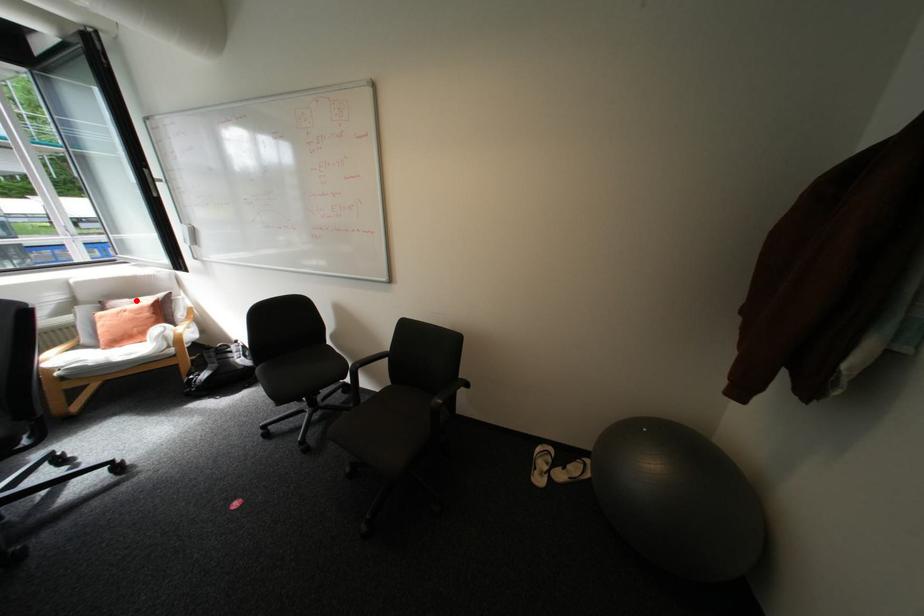
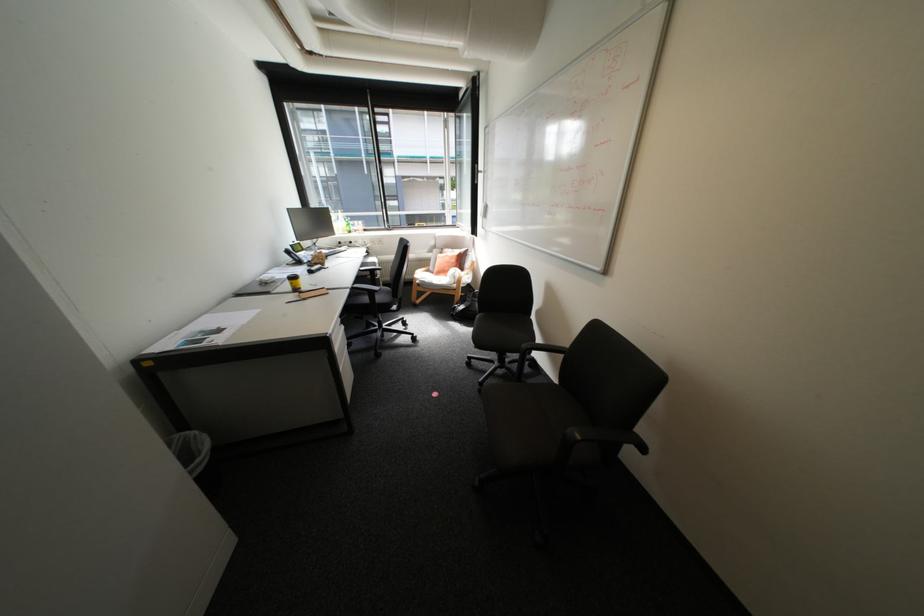
Find the pixel in the second image that matches the highlighted location in the first image.

(459, 249)